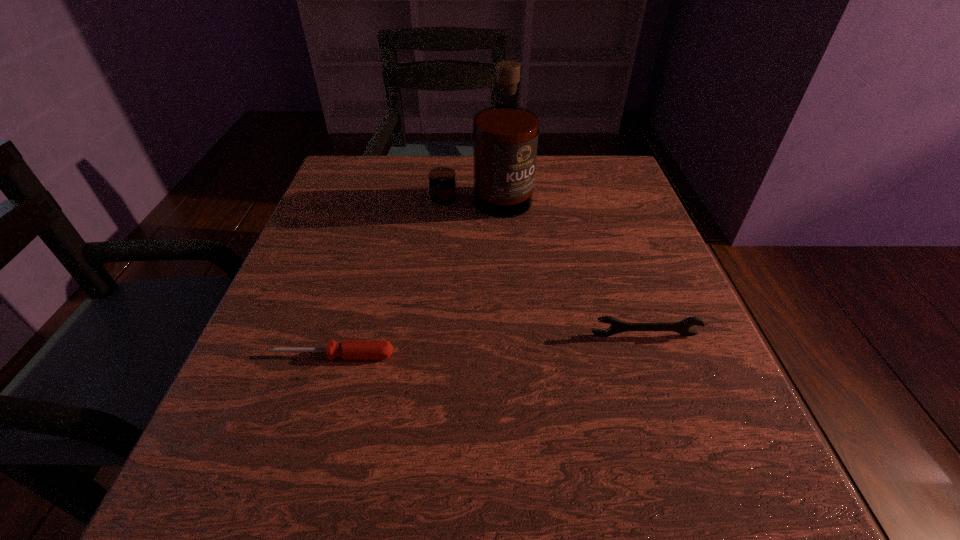
Locate an element on the screen. Image resolution: width=960 pixels, height=540 pixels. object at the left edge is located at coordinates (349, 349).

Find the location of `object present at the right edge`. object present at the right edge is located at coordinates (617, 326).

Identify the location of vacant point at the far edge. The image size is (960, 540). (538, 163).

Where is `vacant region at the near edge of the desktop`? The width and height of the screenshot is (960, 540). vacant region at the near edge of the desktop is located at coordinates (502, 470).

Find the location of a particular element. The height and width of the screenshot is (540, 960). vacant space at the left edge of the desktop is located at coordinates (349, 329).

In the image, there is a desktop. Identify the location of vacant space at the right edge. (652, 271).

Identify the location of vacant area at the far left corner. This screenshot has height=540, width=960. (369, 173).

In the image, there is a desktop. Identify the location of blank space at the far right corner. Image resolution: width=960 pixels, height=540 pixels. (568, 199).

This screenshot has width=960, height=540. Identify the location of free space between the second nearest object and the tallest object. (563, 268).

At what (x,y) coordinates should I click in order to perform the action: click on free space that is in between the nearest object and the rightmost object. Please return your answer as a coordinate pair (x, y). The width and height of the screenshot is (960, 540). Looking at the image, I should click on (489, 345).